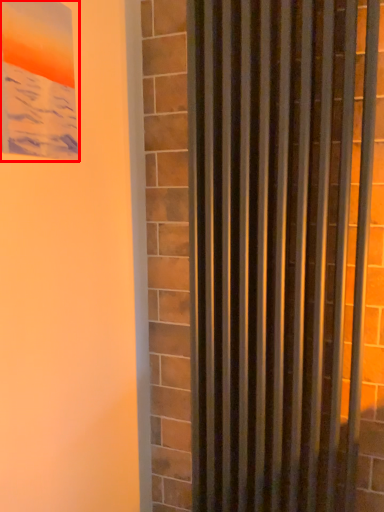
Question: From the image's perspective, what is the correct spatial relationship of picture frame (annotated by the red box) in relation to curtain?

Choices:
 (A) below
 (B) above

Answer: (B)